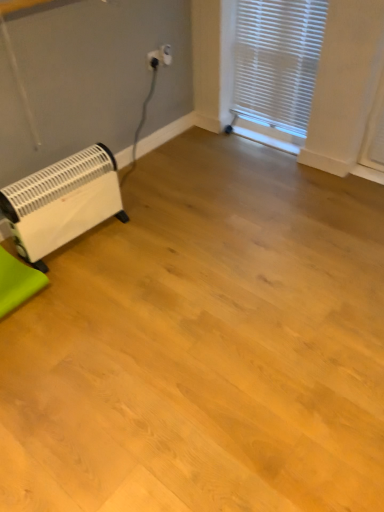
At what (x,y) coordinates should I click in order to perform the action: click on vacant area situated below white plastic heater at lower left (from a real-world perspective). Please return your answer as a coordinate pair (x, y). Looking at the image, I should click on (86, 241).